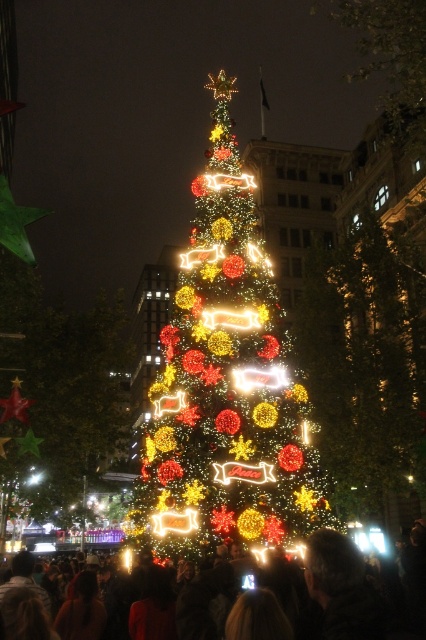
Question: Which of the following is the farthest from the observer?

Choices:
 (A) (396, 22)
 (B) (368, 636)

Answer: (A)

Question: Does illuminated plastic ornaments at center come behind illuminated plastic tree at upper center?

Choices:
 (A) yes
 (B) no

Answer: (B)

Question: Can you confirm if illuminated plastic christmas tree at center is bigger than illuminated plastic tree at upper center?

Choices:
 (A) no
 (B) yes

Answer: (A)

Question: Which object is closer to the camera taking this photo?

Choices:
 (A) illuminated plastic ornaments at center
 (B) matte black crowd at center
 (C) illuminated plastic christmas tree at center
 (D) illuminated plastic tree at upper center

Answer: (B)

Question: Which point is farther to the camera?

Choices:
 (A) (354, 564)
 (B) (353, 76)
 (C) (247, 342)
 (D) (22, 390)

Answer: (B)

Question: Considering the relative positions of illuminated plastic christmas tree at center and matte black crowd at center in the image provided, where is illuminated plastic christmas tree at center located with respect to matte black crowd at center?

Choices:
 (A) below
 (B) above

Answer: (B)